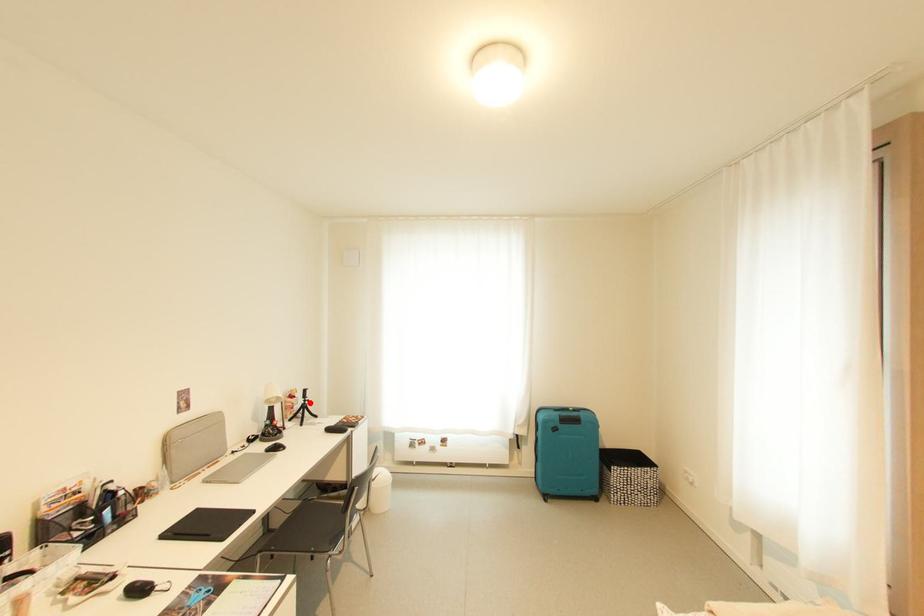
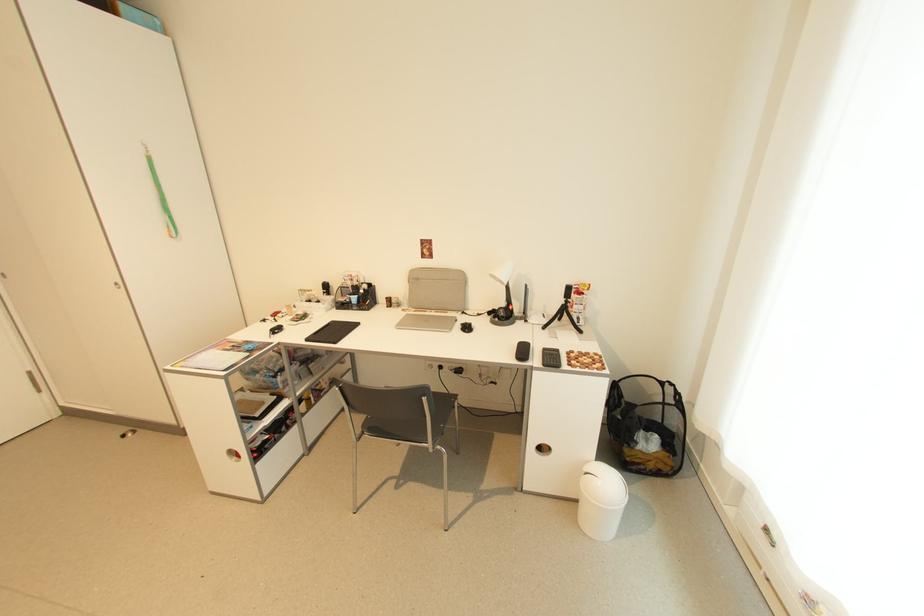
The point at the highlighted location is marked in the first image. Where is the corresponding point in the second image?

(572, 302)